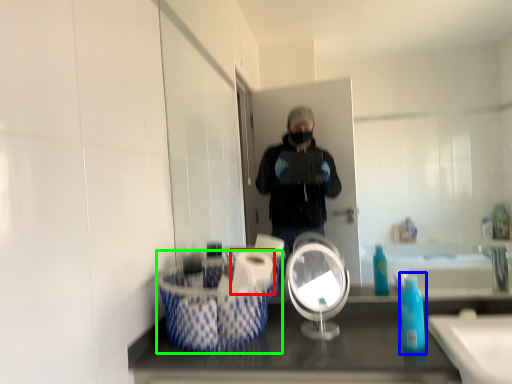
Question: Considering the real-world distances, which object is farthest from toilet paper (highlighted by a red box)? soap dispenser (highlighted by a blue box) or laundry basket (highlighted by a green box)?

Choices:
 (A) soap dispenser
 (B) laundry basket

Answer: (A)